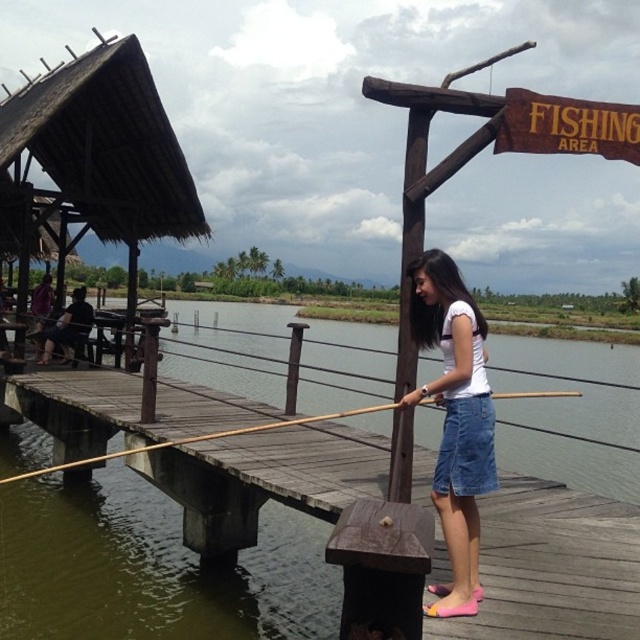
You are a photographer trying to capture a clear shot of the denim skirt at center and the brown wooden fishing pole at center. Since you want both items to be visible in the frame, which object should you focus on to ensure it doesn t get cropped out?

The denim skirt at center occupies less space than the brown wooden fishing pole at center, so you should focus on ensuring the brown wooden fishing pole at center is fully visible in the frame to prevent cropping.

You are standing on the dock and want to cast your fishing line towards the water. The fishing rod is in your right hand, and you need to move your body to the left to avoid hitting the thatched roof. Which direction should you move relative to the denim skirt at center?

You should move to the left relative to the denim skirt at center to avoid hitting the thatched roof while casting your fishing line.

You are standing on the dock and want to hand the brown wooden fishing pole at center to the person wearing the denim skirt at center. Which direction should you move the fishing pole to reach them?

The denim skirt at center is to the left of the brown wooden fishing pole at center, so you should move the fishing pole to the left to reach the person wearing the denim skirt at center.